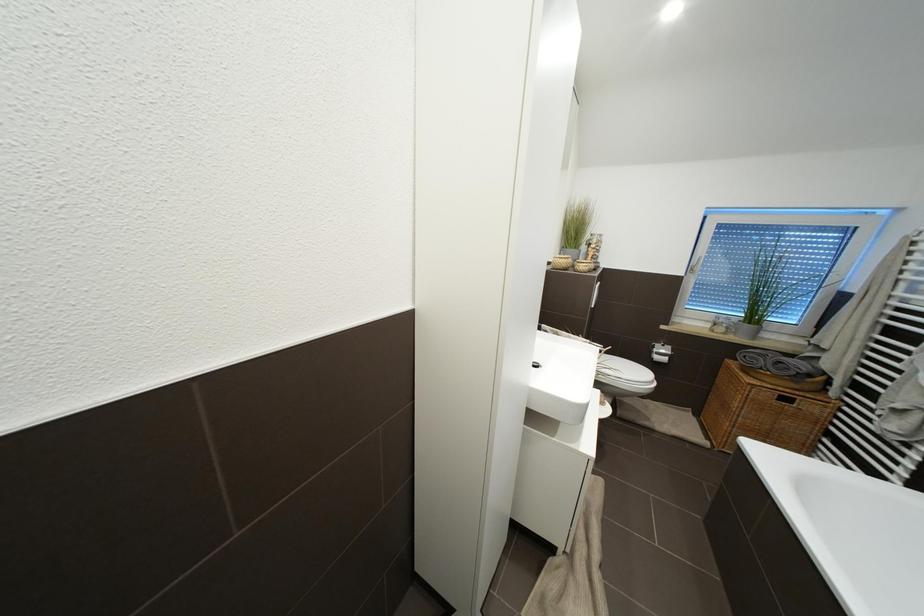
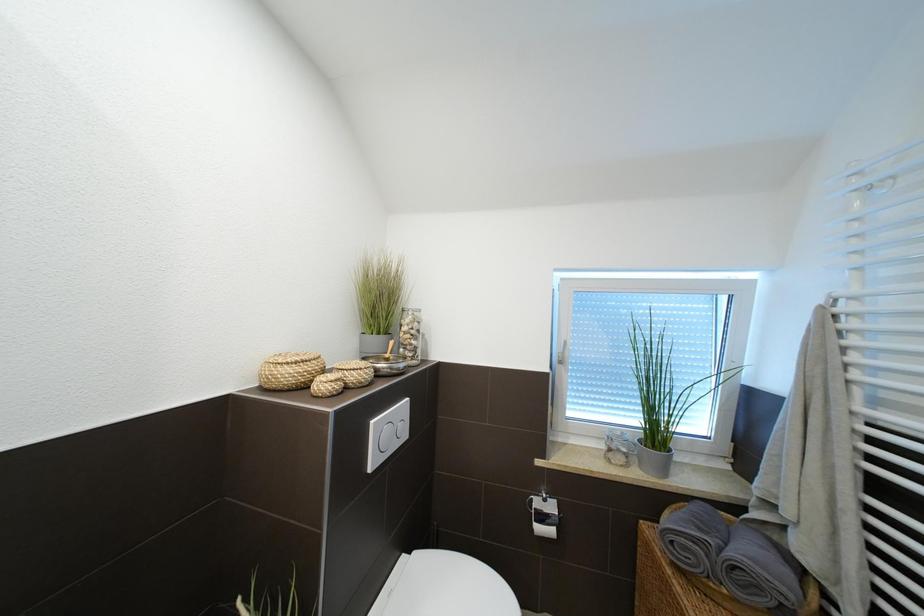
Which direction would the cameraman need to move to produce the second image?

The cameraman walked toward right, forward.